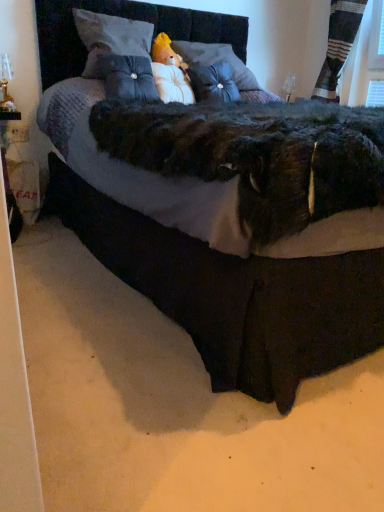
Question: From a real-world perspective, does striped fabric curtain at upper right sit lower than velvet black bed at center?

Choices:
 (A) no
 (B) yes

Answer: (A)

Question: Can you confirm if striped fabric curtain at upper right is smaller than velvet black bed at center?

Choices:
 (A) no
 (B) yes

Answer: (B)

Question: Considering the relative sizes of striped fabric curtain at upper right and velvet black bed at center in the image provided, is striped fabric curtain at upper right taller than velvet black bed at center?

Choices:
 (A) no
 (B) yes

Answer: (A)

Question: Is striped fabric curtain at upper right oriented away from velvet black bed at center?

Choices:
 (A) no
 (B) yes

Answer: (A)

Question: Does striped fabric curtain at upper right have a lesser width compared to velvet black bed at center?

Choices:
 (A) no
 (B) yes

Answer: (B)

Question: From a real-world perspective, is white plush doll at lower left above or below velvet gray pillow at upper center, placed as the 4th pillow when sorted from right to left?

Choices:
 (A) below
 (B) above

Answer: (A)

Question: Is white plush doll at lower left situated inside velvet gray pillow at upper center, which is the first pillow from left to right, or outside?

Choices:
 (A) outside
 (B) inside

Answer: (A)

Question: In terms of height, does white plush doll at lower left look taller or shorter compared to velvet gray pillow at upper center, placed as the 4th pillow when sorted from right to left?

Choices:
 (A) short
 (B) tall

Answer: (B)

Question: Is white plush doll at lower left bigger or smaller than velvet gray pillow at upper center, which is the first pillow from left to right?

Choices:
 (A) big
 (B) small

Answer: (B)

Question: Which is correct: striped fabric curtain at upper right is inside velvet black bed at center, or outside of it?

Choices:
 (A) inside
 (B) outside

Answer: (B)

Question: Is striped fabric curtain at upper right wider or thinner than velvet black bed at center?

Choices:
 (A) thin
 (B) wide

Answer: (A)

Question: From a real-world perspective, is striped fabric curtain at upper right positioned above or below velvet black bed at center?

Choices:
 (A) above
 (B) below

Answer: (A)

Question: In the image, is striped fabric curtain at upper right positioned in front of or behind velvet black bed at center?

Choices:
 (A) front
 (B) behind

Answer: (B)

Question: Considering the positions of point (188, 75) and point (19, 154), is point (188, 75) closer or farther from the camera than point (19, 154)?

Choices:
 (A) closer
 (B) farther

Answer: (A)

Question: Is white plush at center, the second pillow positioned from the right, wider or thinner than white plush doll at lower left?

Choices:
 (A) thin
 (B) wide

Answer: (B)